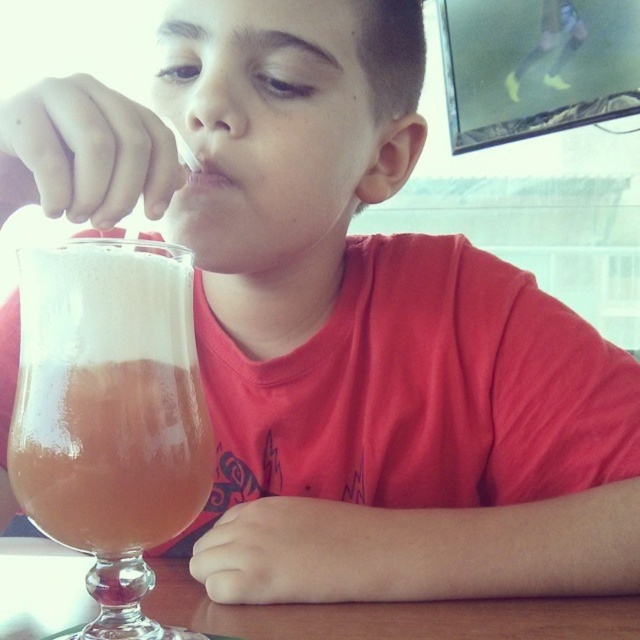
You are a photographer standing at a point 12.49 inches away from the point marked at coordinates point [147,336]. You need to take a photo of the boy drinking from the glass. Will you be able to capture the entire scene without moving closer or farther from the point?

The point marked at coordinates point [147,336] is 12.49 inches away from the camera. Since the photographer is already at that distance, they can capture the entire scene without needing to move closer or farther.

You are a waiter in a restaurant and need to place a new drink order on the table. The existing drink, the translucent glass beverage at lower left, is already there. Where should you place the new drink to avoid spilling the existing one?

The new drink should be placed away from the translucent glass beverage at lower left to prevent it from being knocked over. Since the existing beverage is at point (108, 396), placing the new drink at a different location on the table would ensure safety.

You are a waiter in a cafe and need to place a new order of drinks on the wooden table at lower center. However, there is already a translucent glass beverage at lower left on the table. Where should you place the new drink to avoid spilling it?

The translucent glass beverage at lower left is already above the wooden table at lower center, so you should place the new drink somewhere else on the table away from the existing beverage to prevent spills.